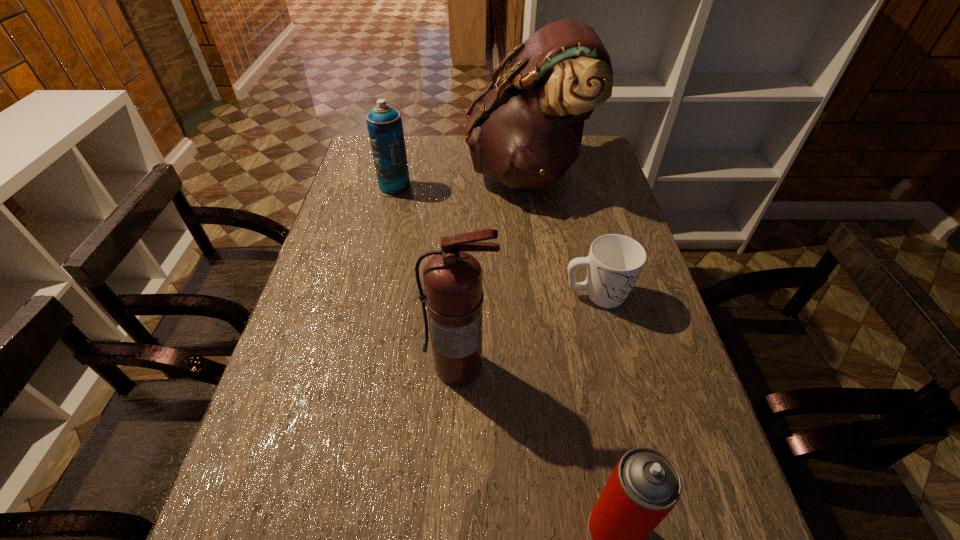
Locate an element on the screen. This screenshot has width=960, height=540. vacant space at the right edge of the desktop is located at coordinates (654, 293).

Identify the location of vacant space at the far right corner of the desktop. (591, 136).

This screenshot has height=540, width=960. In order to click on free space between the fourth shortest object and the mug in this screenshot , I will do `click(528, 330)`.

This screenshot has width=960, height=540. Find the location of `vacant space in between the tallest object and the fire extinguisher`. vacant space in between the tallest object and the fire extinguisher is located at coordinates (493, 269).

Where is `free point between the tallest object and the third nearest object`? free point between the tallest object and the third nearest object is located at coordinates (562, 234).

Locate an element on the screen. The height and width of the screenshot is (540, 960). vacant area that lies between the left aerosol can and the third farthest object is located at coordinates (495, 241).

Where is `free space between the shortest object and the fire extinguisher`? This screenshot has width=960, height=540. free space between the shortest object and the fire extinguisher is located at coordinates (528, 330).

At what (x,y) coordinates should I click in order to perform the action: click on blank region between the leftmost object and the shortest object. Please return your answer as a coordinate pair (x, y). This screenshot has height=540, width=960. Looking at the image, I should click on (495, 241).

The height and width of the screenshot is (540, 960). I want to click on free space that is in between the shortest object and the leftmost object, so coord(495,241).

Where is `object identified as the fourth closest to the shortest object`? Image resolution: width=960 pixels, height=540 pixels. object identified as the fourth closest to the shortest object is located at coordinates (385, 128).